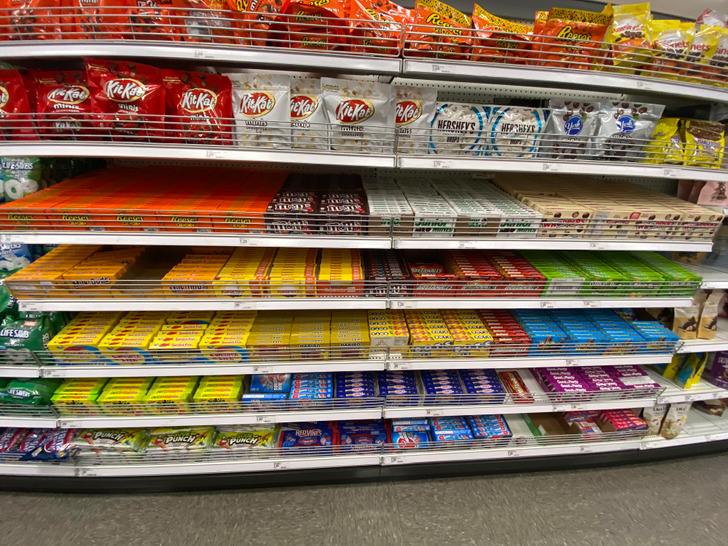
Locate an element on the screen. This screenshot has width=728, height=546. tile floor is located at coordinates (381, 530).